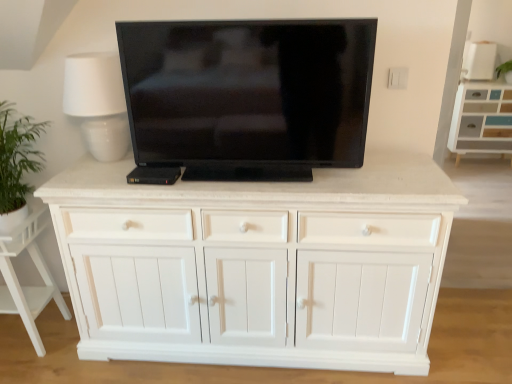
Locate an element on the screen. The width and height of the screenshot is (512, 384). vacant area situated below white wood cabinet at lower left (from a real-world perspective) is located at coordinates (24, 334).